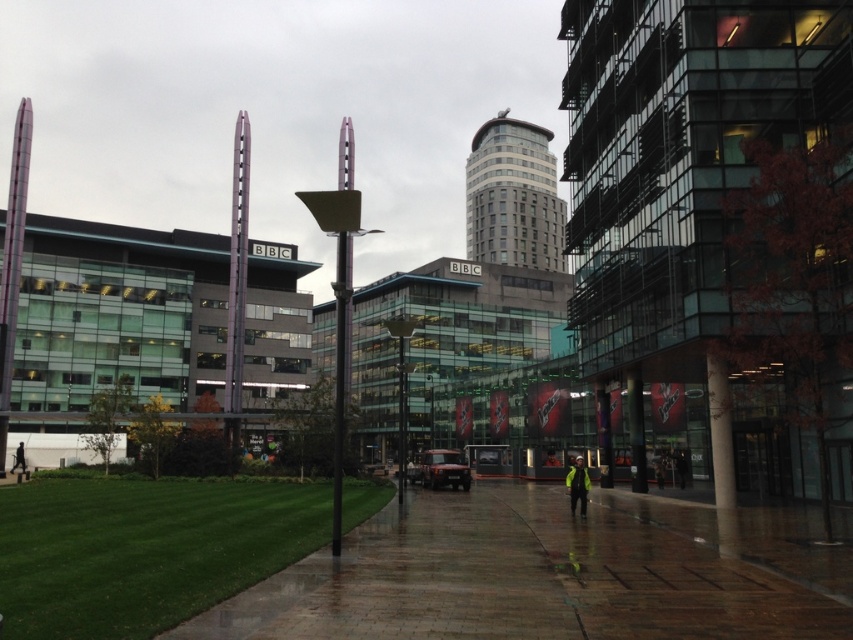
Question: Which point is farther to the camera?

Choices:
 (A) 793,602
 (B) 22,451

Answer: (B)

Question: Does shiny brick pavement at center appear on the left side of high visibility yellow jacket at center?

Choices:
 (A) no
 (B) yes

Answer: (B)

Question: Is shiny brick pavement at center further to camera compared to black jacket at lower left?

Choices:
 (A) no
 (B) yes

Answer: (A)

Question: Can you confirm if shiny brick pavement at center is positioned below black jacket at lower left?

Choices:
 (A) yes
 (B) no

Answer: (B)

Question: Which point is farther from the camera taking this photo?

Choices:
 (A) (22, 452)
 (B) (650, 572)
 (C) (581, 486)

Answer: (A)

Question: Which object is positioned farthest from the shiny brick pavement at center?

Choices:
 (A) high visibility yellow jacket at center
 (B) black jacket at lower left

Answer: (B)